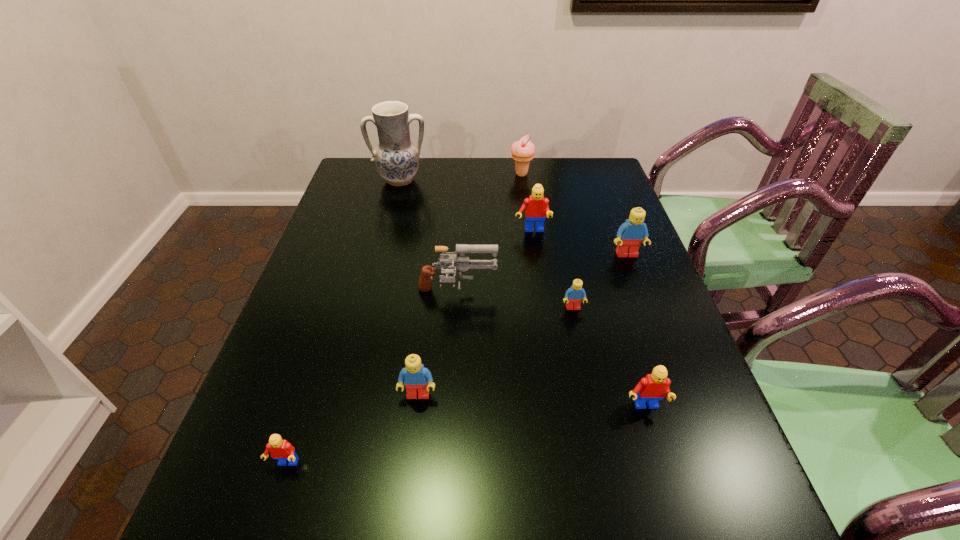
Where is `free space at the far edge`? This screenshot has height=540, width=960. free space at the far edge is located at coordinates (468, 184).

Identify the location of free space at the left edge of the desktop. The image size is (960, 540). (253, 402).

This screenshot has height=540, width=960. In the image, there is a desktop. Find the location of `vacant region at the right edge`. vacant region at the right edge is located at coordinates (642, 423).

Locate an element on the screen. The height and width of the screenshot is (540, 960). free space at the far right corner is located at coordinates (564, 161).

You are a GUI agent. You are given a task and a screenshot of the screen. Output one action in this format:
    pyautogui.click(x=<x>, y=<y>)
    Task: Click on the free spot at the near right corner of the desktop
    Image resolution: width=960 pixels, height=540 pixels.
    Given the screenshot: What is the action you would take?
    pyautogui.click(x=722, y=515)

Find the location of a particular element. This screenshot has width=960, height=540. vacant space that is in between the icecream and the leftmost blue Lego is located at coordinates (469, 285).

Where is `empty space between the icecream and the smallest red Lego`? The image size is (960, 540). empty space between the icecream and the smallest red Lego is located at coordinates (403, 319).

This screenshot has width=960, height=540. I want to click on vacant point located between the fourth nearest Lego and the leftmost blue Lego, so click(x=495, y=351).

The width and height of the screenshot is (960, 540). Identify the location of vacant point located between the icecream and the nearest red Lego. (403, 319).

This screenshot has height=540, width=960. I want to click on vacant space in between the second smallest red Lego and the second biggest blue Lego, so click(531, 401).